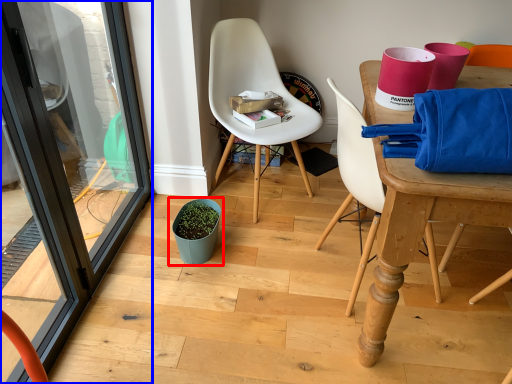
Question: Which object is further to the camera taking this photo, flowerpot (highlighted by a red box) or screen door (highlighted by a blue box)?

Choices:
 (A) flowerpot
 (B) screen door

Answer: (A)